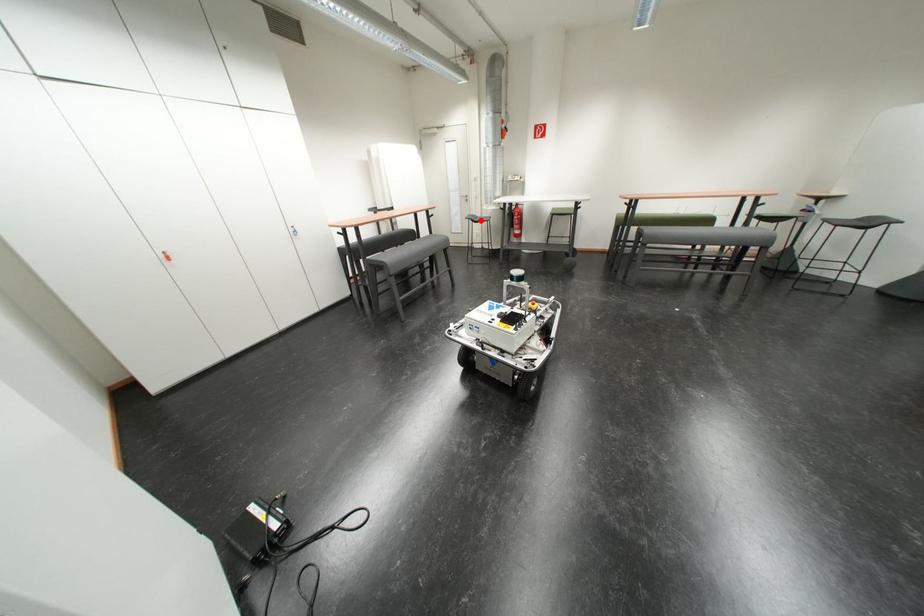
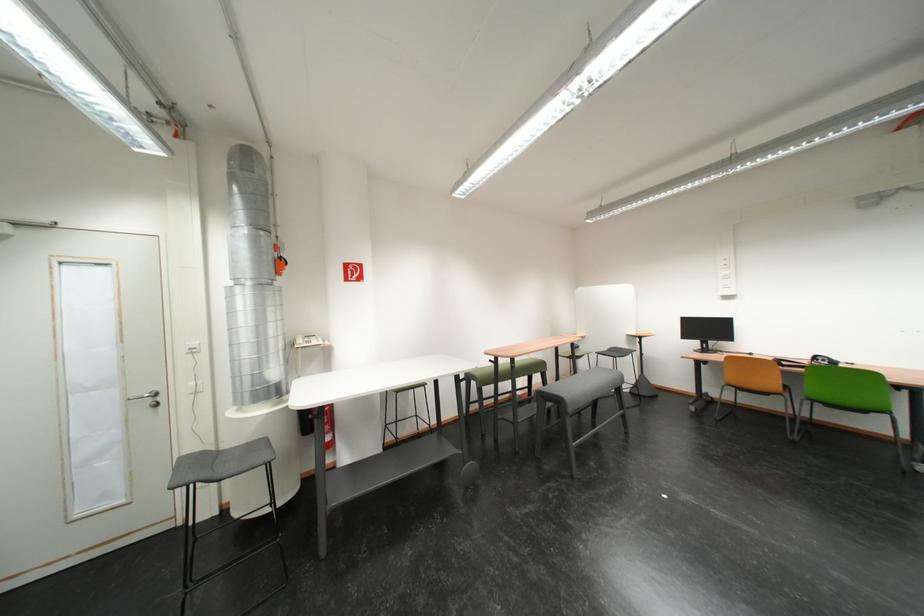
Question: I am providing you with two images of the same scene from different viewpoints. A red point is marked on the first image. At the location where the point appears in image 1, is it still visible in image 2?

Choices:
 (A) Yes
 (B) No

Answer: (A)